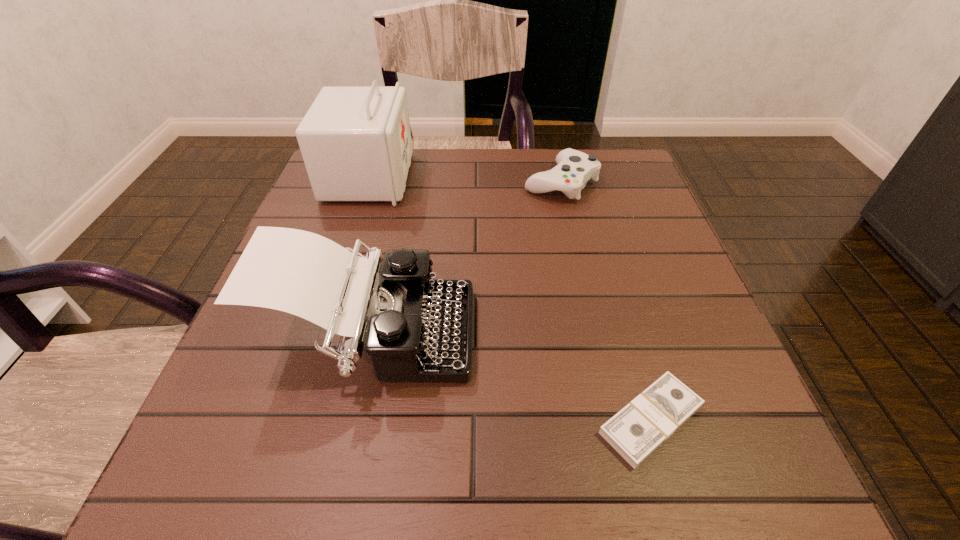
You are a GUI agent. You are given a task and a screenshot of the screen. Output one action in this format:
    pyautogui.click(x=<x>, y=<y>)
    Task: Click on the vacant region that satisfies the following two spatial constraints: 1. on the front-facing side of the control; 2. on the right side of the tallest object
    
    Given the screenshot: What is the action you would take?
    pyautogui.click(x=368, y=183)

At what (x,y) coordinates should I click in order to perform the action: click on free space that satisfies the following two spatial constraints: 1. on the keys of the dollar; 2. on the right side of the typewriter. Please return your answer as a coordinate pair (x, y). This screenshot has width=960, height=540. Looking at the image, I should click on (355, 420).